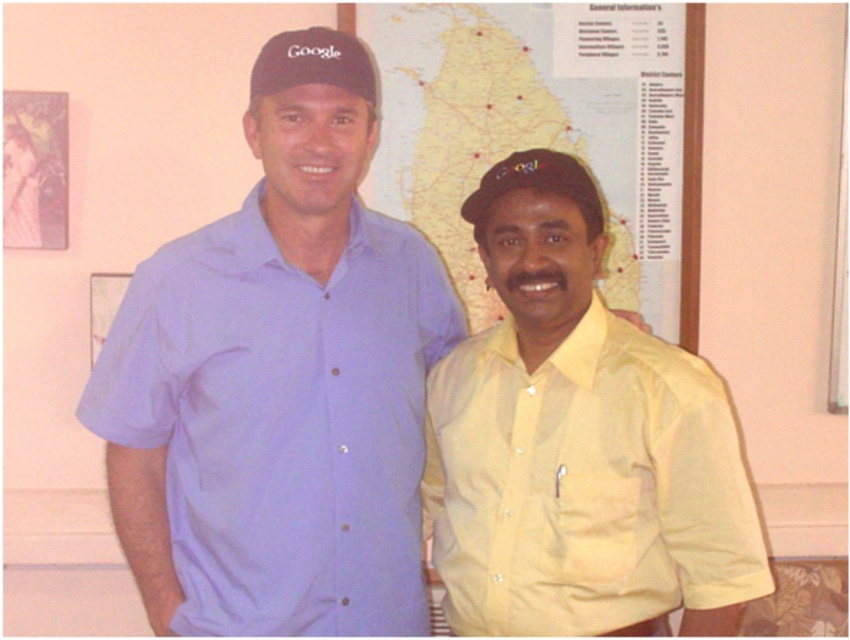
You are an interior designer planning to hang a decorative item between the yellow satin shirt at right and the black matte baseball cap at upper center. Which object should you place closer to the wall to ensure proper balance?

The yellow satin shirt at right has a larger size compared to the black matte baseball cap at upper center, so to balance the visual weight, place the larger yellow satin shirt at right closer to the wall and the smaller black matte baseball cap at upper center further away.

You are organizing a charity event and need to place a large poster on the wall. The poster is the size of the yellow satin shirt at right. There is a matte black cap at center hanging on the wall where you want to place it. Will the poster fit without overlapping the cap?

The yellow satin shirt at right is bigger than the matte black cap at center, so the poster will overlap the matte black cap at center when placed there.

You are standing in an office and see two people. The first person is wearing a light purple short sleeved button up shirt and a black cap with the word Google on it. The second person is wearing a yellow short sleeved button up shirt with a pocket on the left side and also a black cap with a Google logo. There is a point at coordinates (282, 420). Which person is closest to this point?

The point at coordinates (282, 420) is on the matte blue shirt at center. Since the first person is wearing a light purple shirt and the second a yellow shirt, the closest person to the point would be neither, as the point is on a matte blue shirt which isn not mentioned on either of the two people.